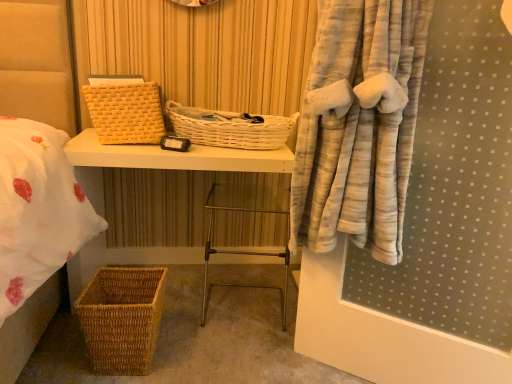
Question: From the image's perspective, would you say metallic silver step stool at center is shown under white wicker basket at center, the 2th basket in the top-to-bottom sequence?

Choices:
 (A) yes
 (B) no

Answer: (A)

Question: Is metallic silver step stool at center turned away from white wicker basket at center, which is the 2th basket in bottom-to-top order?

Choices:
 (A) yes
 (B) no

Answer: (B)

Question: From a real-world perspective, is metallic silver step stool at center beneath white wicker basket at center, which is the 2th basket in bottom-to-top order?

Choices:
 (A) yes
 (B) no

Answer: (A)

Question: Can you confirm if metallic silver step stool at center is smaller than white wicker basket at center, which is the 2th basket in bottom-to-top order?

Choices:
 (A) no
 (B) yes

Answer: (A)

Question: Is metallic silver step stool at center thinner than white wicker basket at center, the 2th basket in the top-to-bottom sequence?

Choices:
 (A) no
 (B) yes

Answer: (B)

Question: Is metallic silver step stool at center surrounding white wicker basket at center, which is the 2th basket in bottom-to-top order?

Choices:
 (A) no
 (B) yes

Answer: (A)

Question: Would you say metallic silver step stool at center is outside woven brown basket at lower left, placed as the first basket when sorted from bottom to top?

Choices:
 (A) yes
 (B) no

Answer: (A)

Question: From the image's perspective, does metallic silver step stool at center appear lower than woven brown basket at lower left, placed as the first basket when sorted from bottom to top?

Choices:
 (A) yes
 (B) no

Answer: (B)

Question: Is metallic silver step stool at center placed right next to woven brown basket at lower left, which is the 3th basket in top-to-bottom order?

Choices:
 (A) no
 (B) yes

Answer: (A)

Question: Is metallic silver step stool at center to the right of woven brown basket at lower left, which is the 3th basket in top-to-bottom order, from the viewer's perspective?

Choices:
 (A) no
 (B) yes

Answer: (B)

Question: Is there a large distance between metallic silver step stool at center and woven brown basket at lower left, placed as the first basket when sorted from bottom to top?

Choices:
 (A) no
 (B) yes

Answer: (A)

Question: Does metallic silver step stool at center lie in front of woven brown basket at lower left, placed as the first basket when sorted from bottom to top?

Choices:
 (A) yes
 (B) no

Answer: (B)

Question: Is white wicker basket at center, which is the 2th basket in bottom-to-top order, next to woven wicker basket at lower left?

Choices:
 (A) no
 (B) yes

Answer: (A)